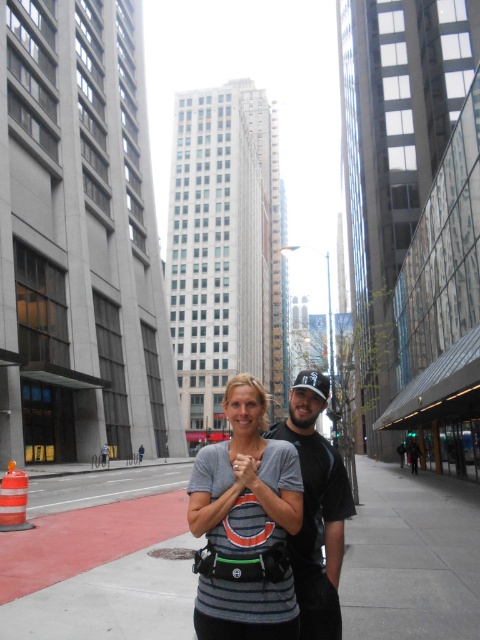
You are standing on the sidewalk and see the gray concrete sidewalk at center and the dark gray fabric shirt at center. Which object is positioned to the right of the other?

The gray concrete sidewalk at center is to the right of the dark gray fabric shirt at center.

You are a photographer standing on the sidewalk in the city scene. You want to take a photo of the dark gray fabric shirt at center and the smooth skin hand at center. Can you fit both subjects into your camera frame if your camera has a minimum focus distance of 20 inches?

The distance between the dark gray fabric shirt at center and the smooth skin hand at center is 21.40 inches. Since the camera requires a minimum focus distance of 20 inches, the 21.40 inches distance is sufficient to capture both subjects within the frame.

You are standing on the sidewalk in the city scene and want to walk towards the two points marked in the image. Which point, point (x=396, y=502) or point (x=240, y=436), will you reach first?

You will reach point (x=396, y=502) first because it is closer to you than point (x=240, y=436), which is further away.